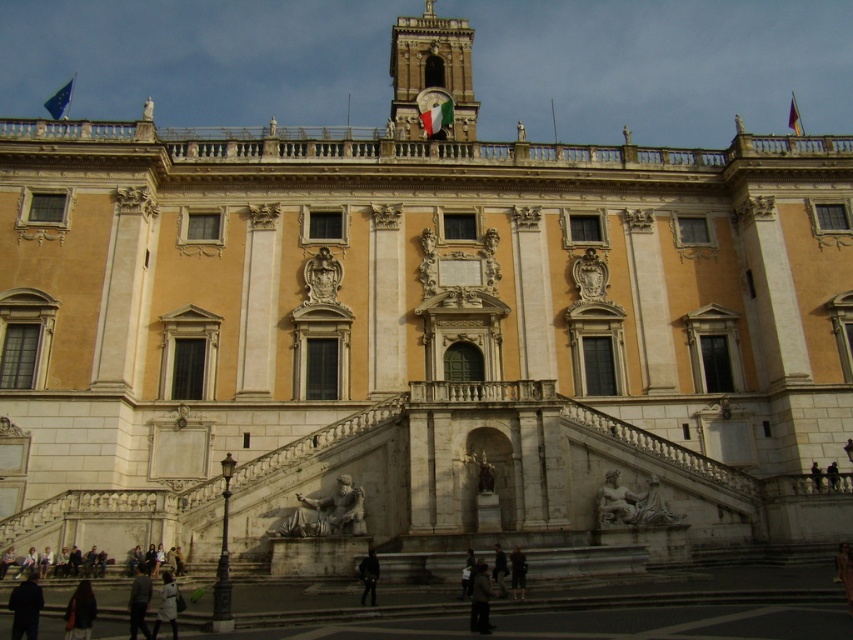
You are standing in front of the grand historical building and see two jackets. The dark brown leather jacket at lower left and the dark fabric jacket at lower center. Which jacket is larger in size?

The dark brown leather jacket at lower left is bigger than the dark fabric jacket at lower center.